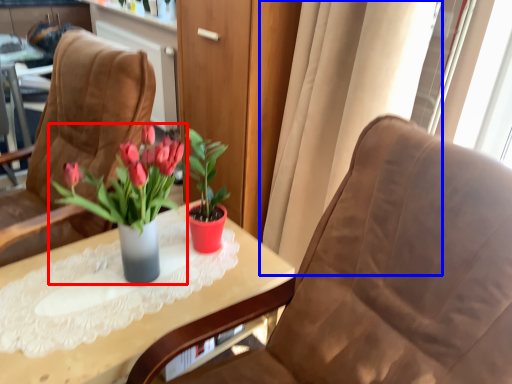
Question: Which of the following is the closest to the observer, houseplant (highlighted by a red box) or curtain (highlighted by a blue box)?

Choices:
 (A) houseplant
 (B) curtain

Answer: (A)